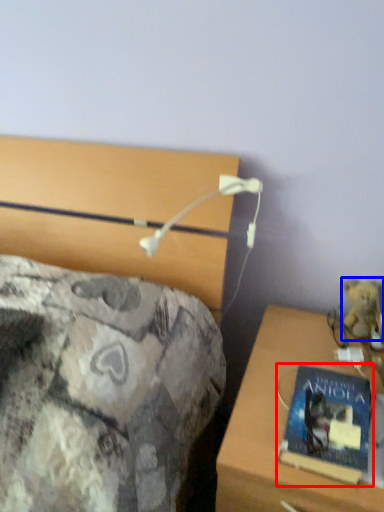
Question: Which object is closer to the camera taking this photo, book (highlighted by a red box) or teddy bear (highlighted by a blue box)?

Choices:
 (A) book
 (B) teddy bear

Answer: (A)